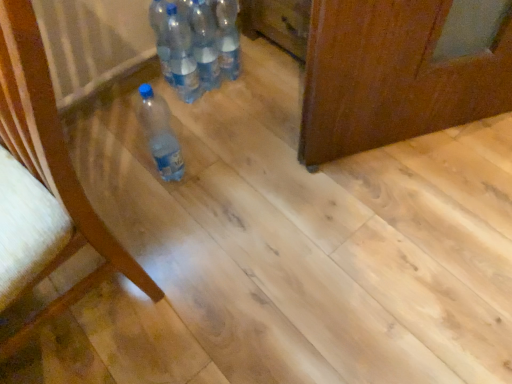
The height and width of the screenshot is (384, 512). In order to click on vacant area that lies between matte wood chair at left and translucent plastic bottle at center, the fourth bottle when ordered from bottom to top in this screenshot , I will do `click(179, 181)`.